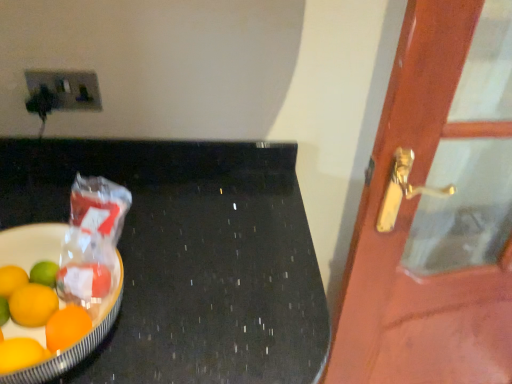
Locate an element on the screen. The image size is (512, 384). vacant region to the right of shiny plastic bowl at left is located at coordinates click(x=216, y=298).